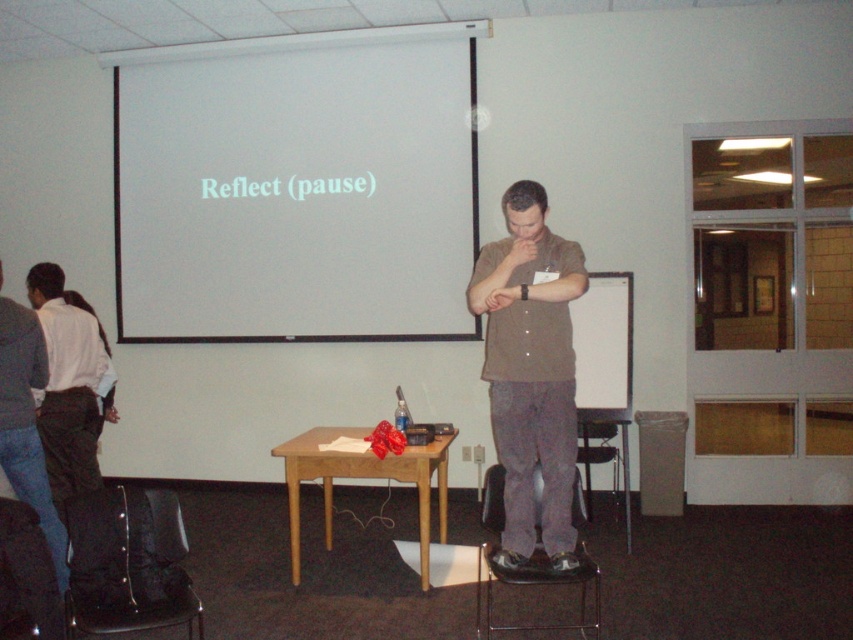
You are an attendee in the classroom. You need to place a laptop on the brown wooden table at center. Can you also see the white matte projection screen at upper center from there?

Yes, because the white matte projection screen at upper center is located above the brown wooden table at center, so you can see it from the table.

You are standing in the classroom and want to place a small object on the wooden table. There are two points marked on the table at coordinates point (456, 284) and point (486, 368). Which point is closer to you when you are facing the table?

Point (456, 284) is further to the camera than point (486, 368). Therefore, point (486, 368) is closer to you when facing the table.

You are a participant in the meeting and need to place a laptop on the brown wooden table at center. However, the screen is obstructing your view. Can you move the white matte projection screen at upper center to access the table?

The brown wooden table at center is behind the white matte projection screen at upper center, so you cannot directly access the table without moving the screen first. However, moving the screen might disrupt the presentation. Consider checking if there is an alternative path or ask for assistance.